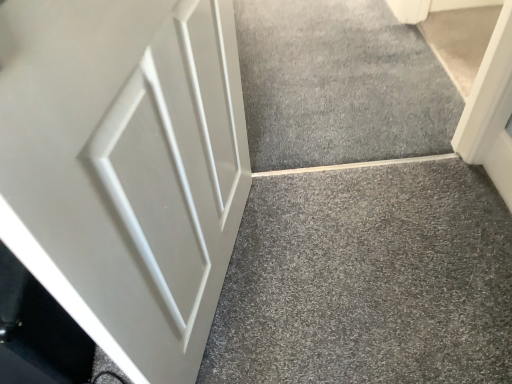
Question: Does white matte door at left come in front of gray carpet at center?

Choices:
 (A) no
 (B) yes

Answer: (B)

Question: Is white matte door at left located outside gray carpet at center?

Choices:
 (A) yes
 (B) no

Answer: (A)

Question: Is white matte door at left oriented away from gray carpet at center?

Choices:
 (A) yes
 (B) no

Answer: (B)

Question: From a real-world perspective, is white matte door at left positioned over gray carpet at center based on gravity?

Choices:
 (A) yes
 (B) no

Answer: (A)

Question: Can you confirm if white matte door at left is bigger than gray carpet at center?

Choices:
 (A) no
 (B) yes

Answer: (B)

Question: Is white matte door at left oriented towards gray carpet at center?

Choices:
 (A) no
 (B) yes

Answer: (A)

Question: Is gray carpet at center directly adjacent to white matte door at left?

Choices:
 (A) yes
 (B) no

Answer: (B)

Question: Can you confirm if gray carpet at center is wider than white matte door at left?

Choices:
 (A) no
 (B) yes

Answer: (B)

Question: Is gray carpet at center not within white matte door at left?

Choices:
 (A) yes
 (B) no

Answer: (A)

Question: Does gray carpet at center come behind white matte door at left?

Choices:
 (A) no
 (B) yes

Answer: (B)

Question: From a real-world perspective, is gray carpet at center over white matte door at left?

Choices:
 (A) yes
 (B) no

Answer: (B)

Question: Could white matte door at left be considered to be inside gray carpet at center?

Choices:
 (A) no
 (B) yes

Answer: (A)

Question: Considering the positions of point (395, 54) and point (160, 336), is point (395, 54) closer or farther from the camera than point (160, 336)?

Choices:
 (A) closer
 (B) farther

Answer: (B)